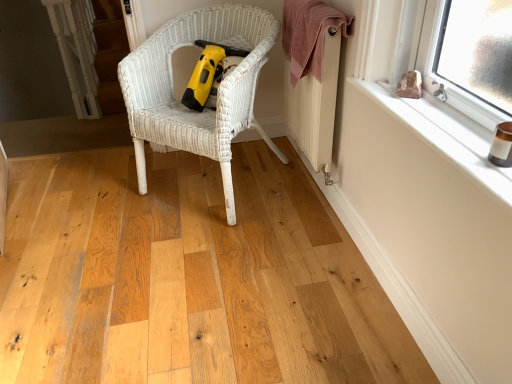
Question: Is pink towel at upper right far from white wicker chair at center?

Choices:
 (A) yes
 (B) no

Answer: (B)

Question: From the image's perspective, is pink towel at upper right located above white wicker chair at center?

Choices:
 (A) no
 (B) yes

Answer: (B)

Question: Considering the relative positions of pink towel at upper right and white wicker chair at center in the image provided, is pink towel at upper right in front of white wicker chair at center?

Choices:
 (A) yes
 (B) no

Answer: (B)

Question: Does pink towel at upper right appear on the right side of white wicker chair at center?

Choices:
 (A) no
 (B) yes

Answer: (B)

Question: Is pink towel at upper right not inside white wicker chair at center?

Choices:
 (A) yes
 (B) no

Answer: (A)

Question: Is pink towel at upper right wider than white wicker chair at center?

Choices:
 (A) no
 (B) yes

Answer: (A)

Question: Is white textured radiator at upper right with white painted wood at upper right?

Choices:
 (A) no
 (B) yes

Answer: (A)

Question: Does white textured radiator at upper right have a greater height compared to white painted wood at upper right?

Choices:
 (A) yes
 (B) no

Answer: (A)

Question: Does white textured radiator at upper right lie in front of white painted wood at upper right?

Choices:
 (A) no
 (B) yes

Answer: (A)

Question: From the image's perspective, is white textured radiator at upper right on top of white painted wood at upper right?

Choices:
 (A) no
 (B) yes

Answer: (B)

Question: From a real-world perspective, is white textured radiator at upper right over white painted wood at upper right?

Choices:
 (A) no
 (B) yes

Answer: (A)

Question: Does white textured radiator at upper right have a greater width compared to white painted wood at upper right?

Choices:
 (A) yes
 (B) no

Answer: (B)

Question: Is white painted wood at upper right outside of white wicker chair at center?

Choices:
 (A) no
 (B) yes

Answer: (B)